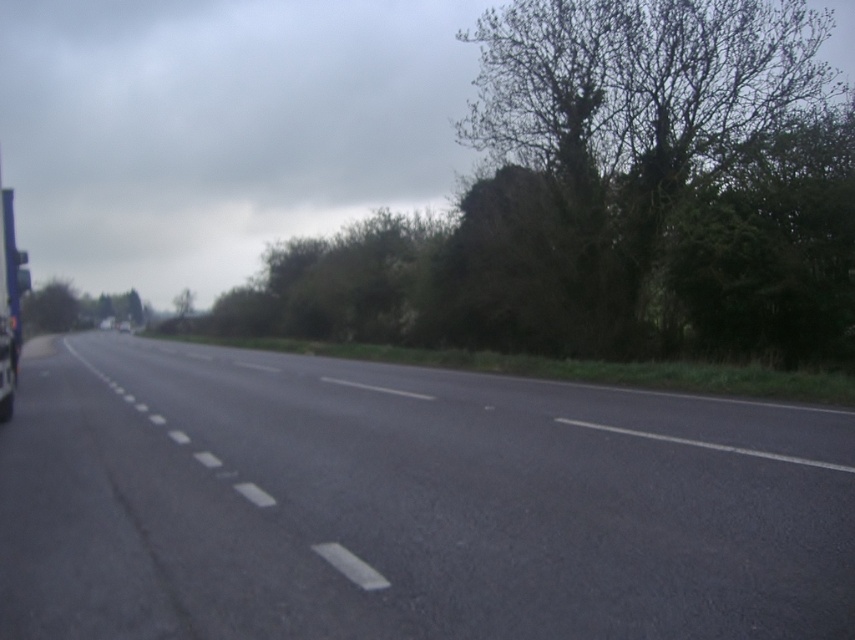
Question: Where is green leafy tree at upper right located in relation to metallic silver trailer truck at left in the image?

Choices:
 (A) left
 (B) right

Answer: (B)

Question: Can you confirm if black asphalt highway at center is positioned to the right of green leafy tree at upper right?

Choices:
 (A) yes
 (B) no

Answer: (B)

Question: Among these points, which one is farthest from the camera?

Choices:
 (A) (663, 516)
 (B) (788, 228)
 (C) (54, 301)

Answer: (C)

Question: Which object is positioned farthest from the green leafy tree at upper right?

Choices:
 (A) green leafy tree at upper left
 (B) black asphalt highway at center

Answer: (A)

Question: Among these points, which one is farthest from the camera?

Choices:
 (A) (609, 93)
 (B) (46, 330)
 (C) (34, 419)

Answer: (B)

Question: Is metallic silver trailer truck at left positioned in front of green leafy tree at upper left?

Choices:
 (A) yes
 (B) no

Answer: (A)